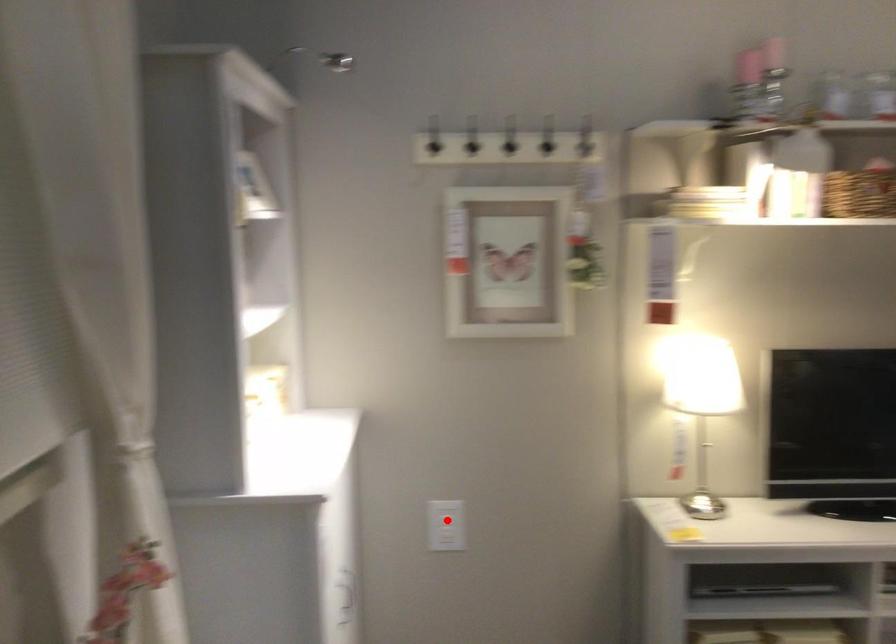
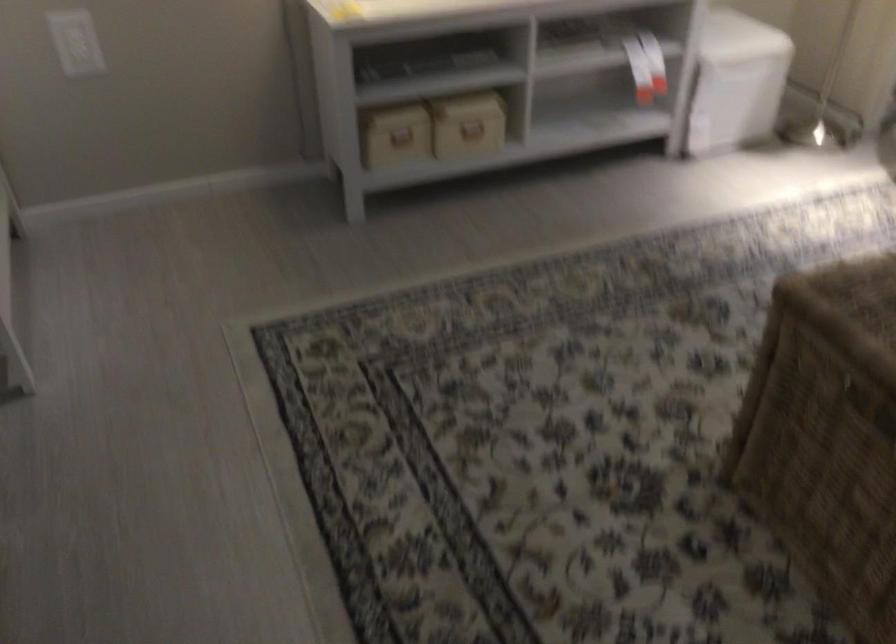
Question: I am providing you with two images of the same scene from different viewpoints. A red point is shown in image1. For the corresponding object point in image2, is it positioned nearer or farther from the camera?

Choices:
 (A) Nearer
 (B) Farther

Answer: (A)